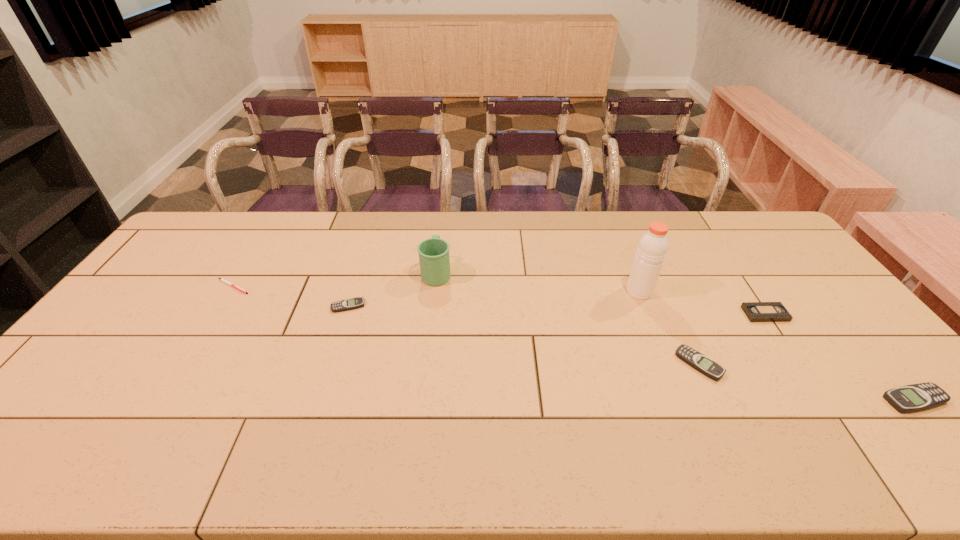
Where is `videotape`? videotape is located at coordinates click(755, 311).

This screenshot has width=960, height=540. Identify the location of the tallest object. (652, 248).

Identify the location of free space located 0.070m on the left of the leftmost beeper. (308, 306).

You are a GUI agent. You are given a task and a screenshot of the screen. Output one action in this format:
    pyautogui.click(x=<x>, y=<y>)
    Task: Click on the free spot located on the back of the second shortest beeper
    
    Given the screenshot: What is the action you would take?
    pyautogui.click(x=649, y=258)

Locate an element on the screen. Image resolution: width=960 pixels, height=540 pixels. vacant point located 0.190m on the back of the tallest beeper is located at coordinates (854, 330).

What are the coordinates of `free space located on the clicker of the shortest object` in the screenshot? It's located at (303, 286).

Where is `blank space located 0.240m on the side of the third object from left to right with the handle`? The height and width of the screenshot is (540, 960). blank space located 0.240m on the side of the third object from left to right with the handle is located at coordinates (443, 219).

Where is `vacant area situated on the side of the third object from left to right with the handle`? The height and width of the screenshot is (540, 960). vacant area situated on the side of the third object from left to right with the handle is located at coordinates (440, 245).

You are a GUI agent. You are given a task and a screenshot of the screen. Output one action in this format:
    pyautogui.click(x=<x>, y=<y>)
    Task: Click on the vacant region located 0.050m on the side of the third object from left to right with the handle
    
    Given the screenshot: What is the action you would take?
    [439, 249]

Identify the location of vacant point located on the left of the videotape. The height and width of the screenshot is (540, 960). (671, 314).